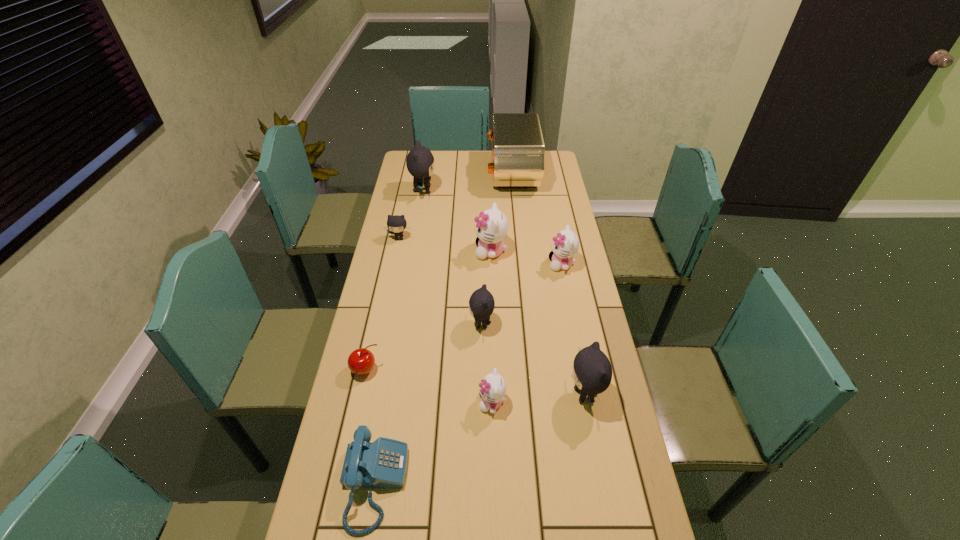
I want to click on object at the far right corner, so click(x=518, y=151).

Find the location of a particular element. The height and width of the screenshot is (540, 960). vacant position at the far edge of the desktop is located at coordinates (453, 173).

This screenshot has width=960, height=540. Find the location of `blank space at the left edge`. blank space at the left edge is located at coordinates (396, 249).

Locate an element on the screen. The width and height of the screenshot is (960, 540). free space at the right edge is located at coordinates (590, 507).

Locate an element on the screen. This screenshot has width=960, height=540. free region at the far right corner of the desktop is located at coordinates (554, 162).

You are a GUI agent. You are given a task and a screenshot of the screen. Output one action in this format:
    pyautogui.click(x=<x>, y=<y>)
    Task: Click on the free space between the third smallest gray kitten and the second nearest gray kitten
    The width and height of the screenshot is (960, 540).
    Given the screenshot: What is the action you would take?
    pyautogui.click(x=533, y=360)

In order to click on vacant area that lies between the second farthest gray kitten and the third gray kitten from left to right in this screenshot , I will do `click(441, 281)`.

At what (x,y) coordinates should I click in order to perform the action: click on vacant point located between the telephone and the toaster oven. Please return your answer as a coordinate pair (x, y). Image resolution: width=960 pixels, height=540 pixels. Looking at the image, I should click on (443, 329).

Where is `free spot between the rightmost white kitten and the biggest white kitten`? free spot between the rightmost white kitten and the biggest white kitten is located at coordinates (526, 258).

Find the location of a particular element. Image resolution: width=960 pixels, height=540 pixels. vacant region between the second smallest white kitten and the blue telephone is located at coordinates (468, 374).